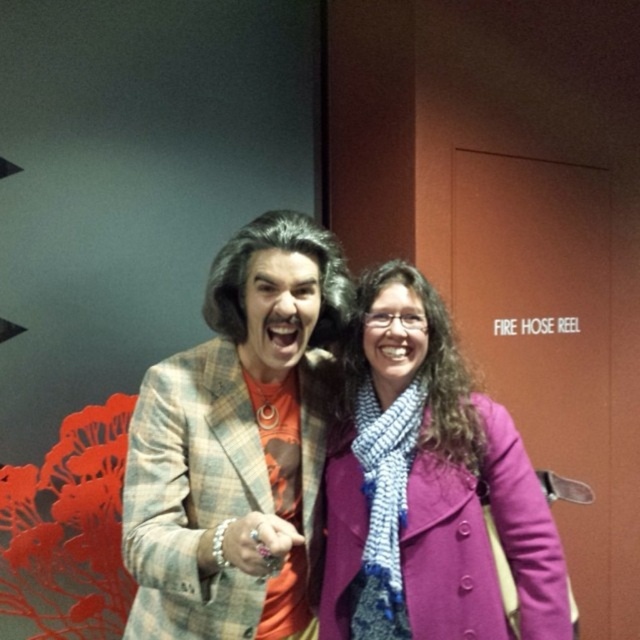
Based on the photo, you are trying to decide which coat to wear for a cold day. Both the plaid fabric jacket at center and the purple woolen coat at center are options. Based on their sizes, which one might provide more coverage and warmth?

The purple woolen coat at center has a greater width than the plaid fabric jacket at center, so it might provide more coverage and warmth.

You are standing at the point labeled point (154, 456). You want to move 1.5 meters forward in the direction you are facing. Will you collide with the two people in the image?

The distance between you and the viewer is 1.21 meters. Moving 1.5 meters forward would exceed that distance, so you would not collide with the two people in the image.

From the picture: You are an artist trying to sketch the scene. You need to place the plaid fabric jacket at center in your drawing. What coordinates should you use for its position?

The plaid fabric jacket at center should be placed at coordinates point [234,445].